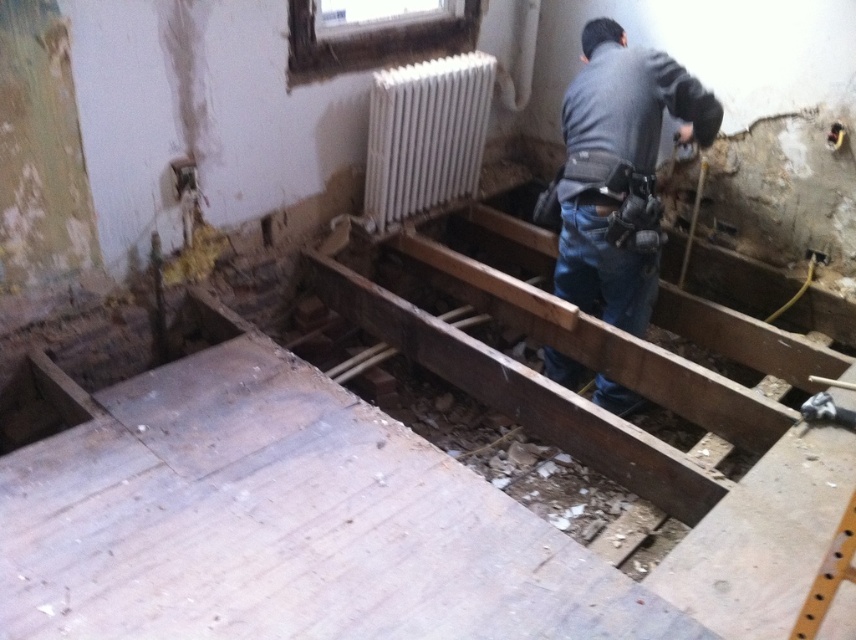
You are a contractor assessing the room. You see the dark gray shirt at center and the dark brown wooden hole at lower left. Which object is taller?

The dark gray shirt at center is taller than the dark brown wooden hole at lower left according to the description.

You are a construction worker who needs to access the dark brown wooden hole at lower left. There is a white metallic radiator at upper center blocking your path. Can you move around it to reach the hole?

The white metallic radiator at upper center is to the right of dark brown wooden hole at lower left, so you can move around the radiator to the left side to reach the dark brown wooden hole at lower left.

Consider the image. You are a contractor assessing the room. You notice the dark gray shirt at center and the white metallic radiator at upper center. Which object is positioned higher up in the room?

The white metallic radiator at upper center is positioned higher up in the room than the dark gray shirt at center.